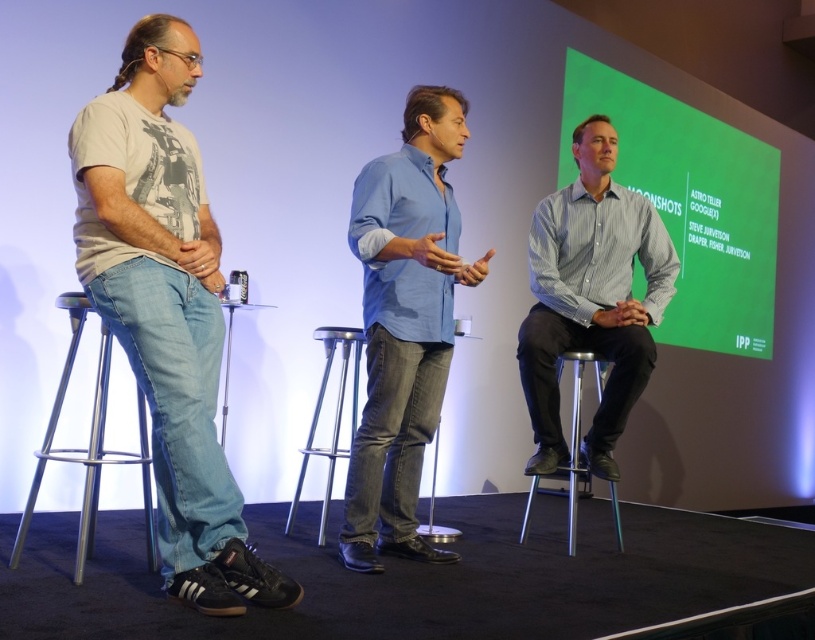
Question: Which object is positioned closest to the gray striped shirt at center?

Choices:
 (A) blue denim jeans at center
 (B) metallic silver bar stool at center
 (C) green matte projection screen at upper center
 (D) matte gray t-shirt at left

Answer: (A)

Question: From the image, what is the correct spatial relationship of green matte projection screen at upper center in relation to metallic silver bar stool at center?

Choices:
 (A) left
 (B) right

Answer: (B)

Question: Which of these objects is positioned closest to the metallic silver bar stool at center?

Choices:
 (A) blue denim jeans at center
 (B) gray striped shirt at center
 (C) green matte projection screen at upper center

Answer: (A)

Question: Which point is closer to the camera taking this photo?

Choices:
 (A) (589, 477)
 (B) (752, 300)
 (C) (342, 449)

Answer: (C)

Question: Considering the relative positions of gray striped shirt at center and metallic silver bar stool at center in the image provided, where is gray striped shirt at center located with respect to metallic silver bar stool at center?

Choices:
 (A) right
 (B) left

Answer: (A)

Question: Can you confirm if blue denim jeans at center is wider than green matte projection screen at upper center?

Choices:
 (A) no
 (B) yes

Answer: (A)